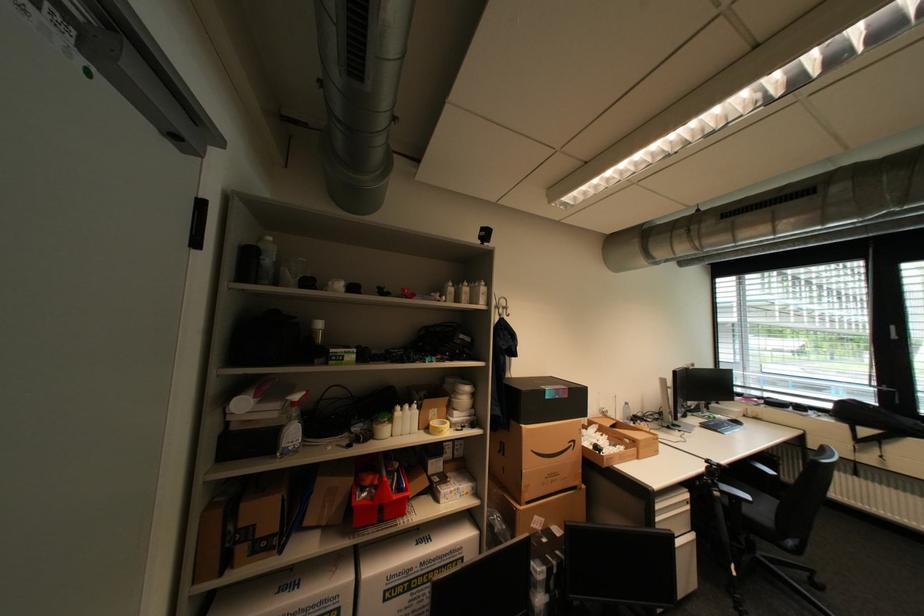
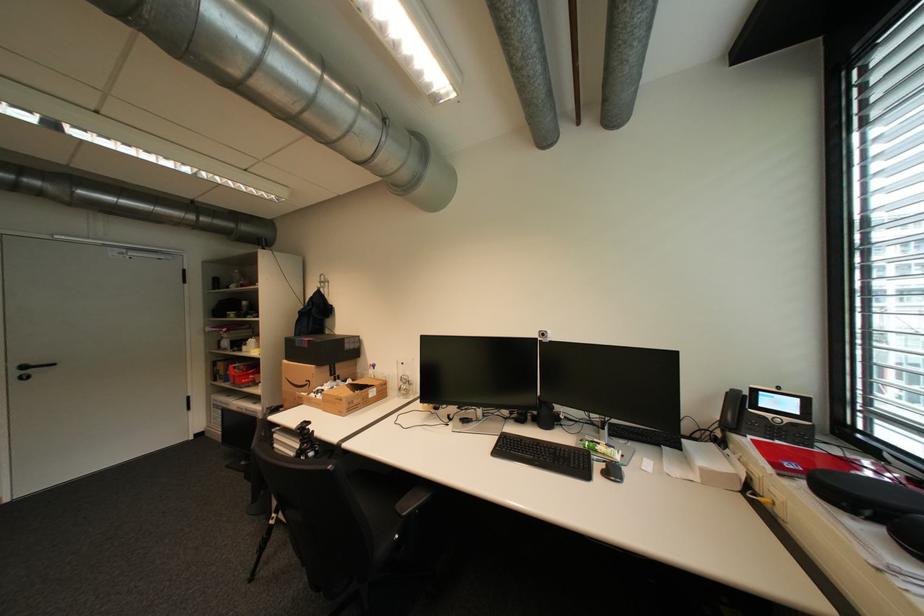
The point at (565, 397) is marked in the first image. Where is the corresponding point in the second image?

(310, 346)